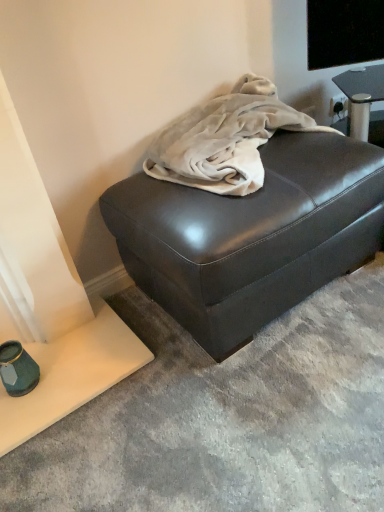
Question: Should I look upward or downward to see matte black ottoman at center?

Choices:
 (A) down
 (B) up

Answer: (B)